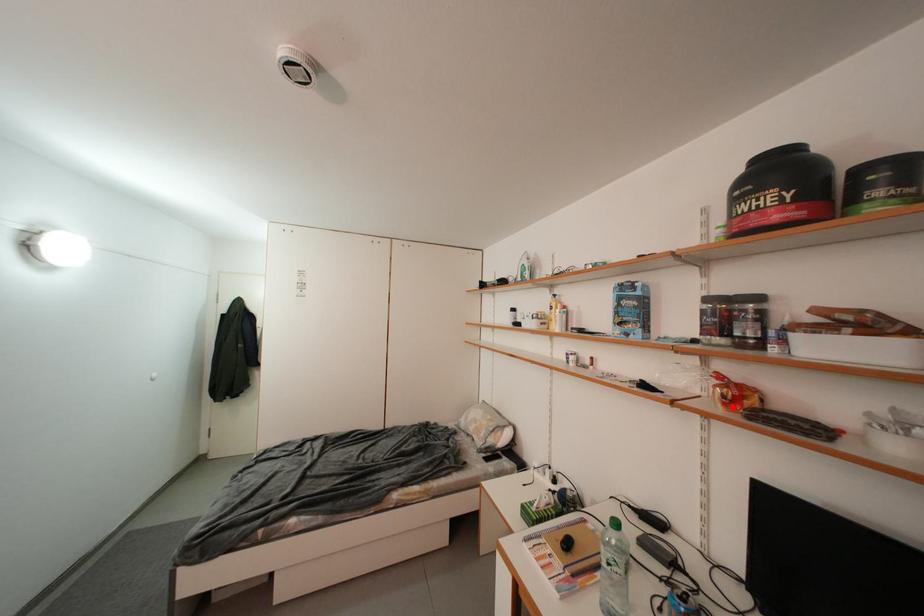
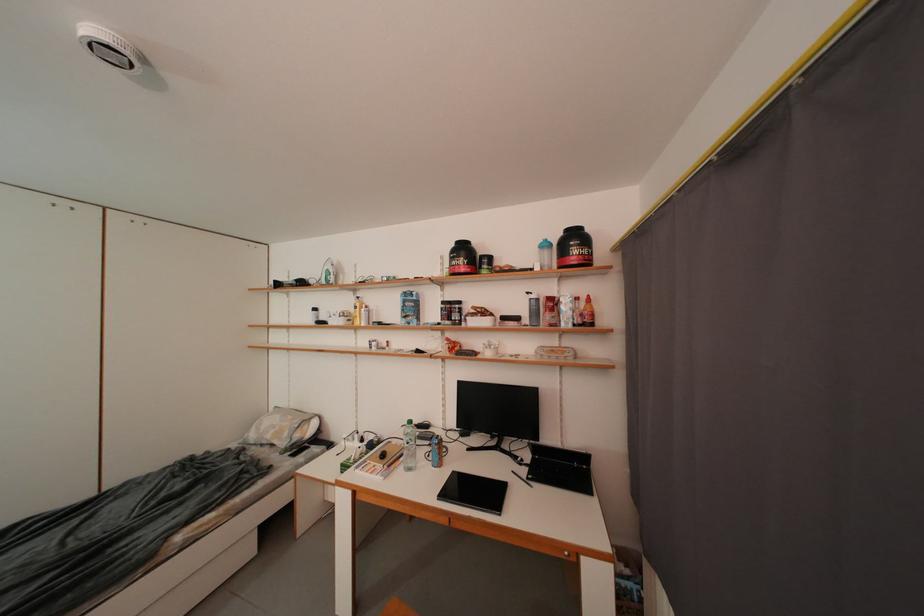
The point at the highlighted location is marked in the first image. Where is the corresponding point in the second image?

(457, 355)